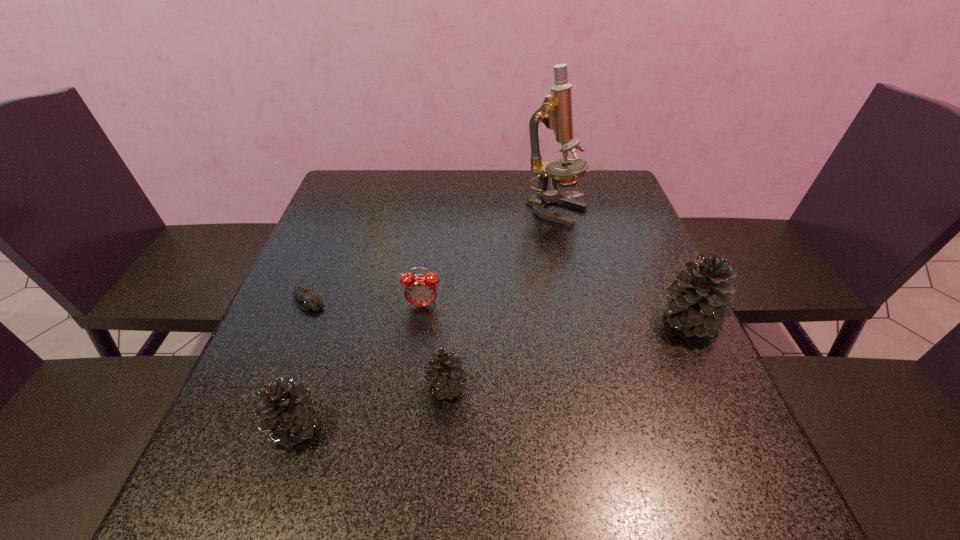
The height and width of the screenshot is (540, 960). Find the location of `object located in the far right corner section of the desktop`. object located in the far right corner section of the desktop is located at coordinates (556, 113).

In the image, there is a desktop. Where is `free region at the far edge`? free region at the far edge is located at coordinates (516, 207).

Locate an element on the screen. This screenshot has width=960, height=540. vacant space at the near edge of the desktop is located at coordinates (339, 427).

This screenshot has height=540, width=960. What are the coordinates of `free space at the right edge` in the screenshot? It's located at (633, 343).

Locate an element on the screen. free space at the far left corner is located at coordinates (356, 192).

The image size is (960, 540). I want to click on free space between the second pinecone from left to right and the rightmost object, so click(x=568, y=354).

Where is `vacant space in between the second object from right to left and the shortest object`? The width and height of the screenshot is (960, 540). vacant space in between the second object from right to left and the shortest object is located at coordinates (432, 256).

I want to click on free space between the shortest pinecone and the microscope, so click(502, 299).

At what (x,y) coordinates should I click in order to perform the action: click on vacant point located between the tallest object and the leftmost pinecone. Please return your answer as a coordinate pair (x, y). The width and height of the screenshot is (960, 540). Looking at the image, I should click on (426, 320).

At what (x,y) coordinates should I click in order to perform the action: click on free spot between the tallest pinecone and the leftmost pinecone. Please return your answer as a coordinate pair (x, y). Looking at the image, I should click on (493, 374).